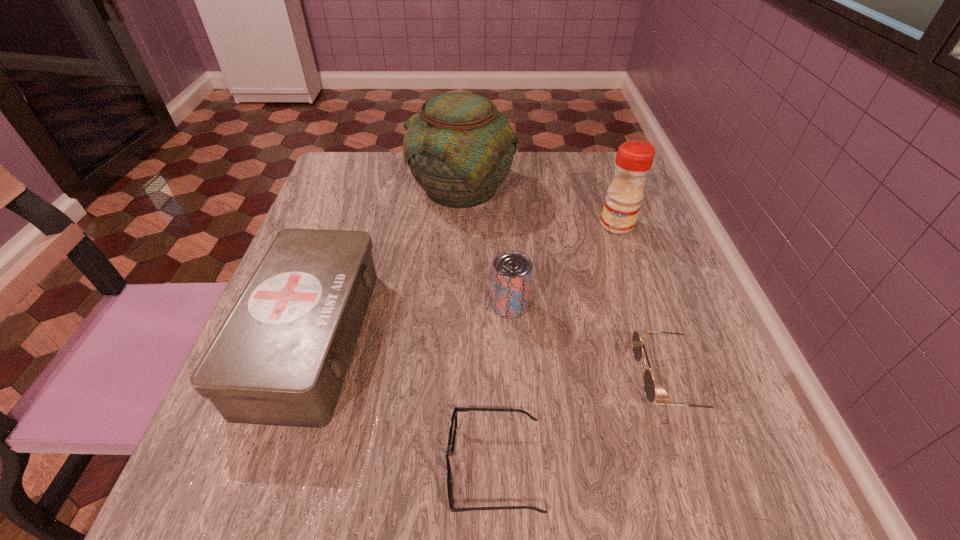
Where is `unoccupied position between the beer can and the spectacles`? The height and width of the screenshot is (540, 960). unoccupied position between the beer can and the spectacles is located at coordinates (502, 386).

The height and width of the screenshot is (540, 960). Find the location of `vacant point located between the first-aid kit and the pottery`. vacant point located between the first-aid kit and the pottery is located at coordinates (386, 262).

Find the location of a particular element. This screenshot has width=960, height=540. free area in between the spectacles and the second shortest object is located at coordinates (583, 424).

Where is `free space between the condiment and the spectacles`? The image size is (960, 540). free space between the condiment and the spectacles is located at coordinates (556, 346).

You are a GUI agent. You are given a task and a screenshot of the screen. Output one action in this format:
    pyautogui.click(x=<x>, y=<y>)
    Task: Click on the blank region between the first-aid kit and the beer can
    The image size is (960, 540).
    Given the screenshot: What is the action you would take?
    pyautogui.click(x=411, y=321)

I want to click on vacant point located between the fifth tallest object and the leftmost object, so click(492, 359).

Locate an element on the screen. Image resolution: width=960 pixels, height=540 pixels. free space between the beer can and the first-aid kit is located at coordinates (411, 321).

Identify which object is the second nearest to the pottery. Please provide its 2D coordinates. Your answer should be formatted as a tuple, i.e. [(x, y)], where the tuple contains the x and y coordinates of a point satisfying the conditions above.

[(634, 159)]

Locate an element on the screen. the second closest object to the spectacles is located at coordinates (638, 337).

You are a GUI agent. You are given a task and a screenshot of the screen. Output one action in this format:
    pyautogui.click(x=<x>, y=<y>)
    Task: Click on the vacant space that satisfies the following two spatial constraints: 1. on the front side of the pottery; 2. on the left side of the beer can
    The height and width of the screenshot is (540, 960).
    Given the screenshot: What is the action you would take?
    (455, 305)